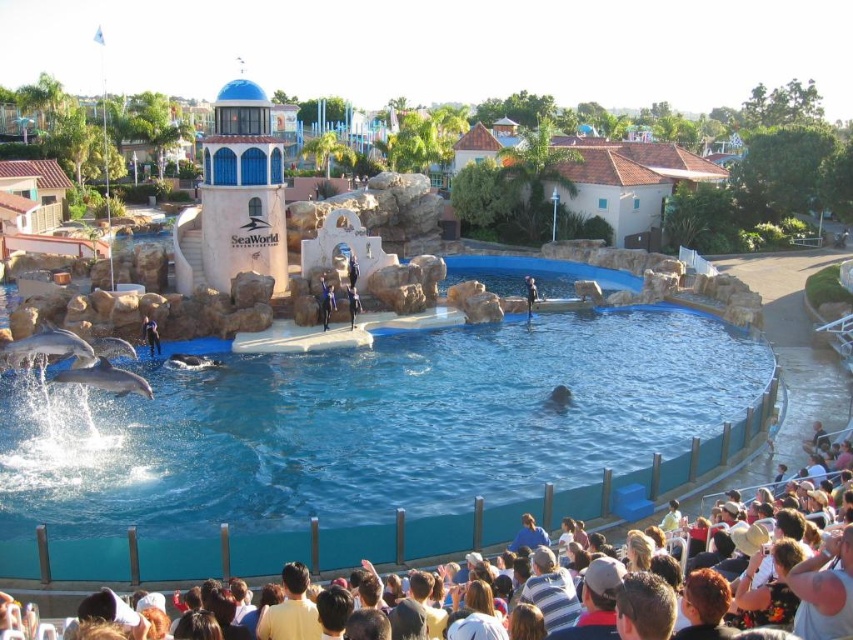
You are a photographer positioned at the front row of the bleachers. You want to take a photo of both the gray matte dolphin at lower left and the gray matte dolphin at center. However, you notice that one is blocking the other. Which dolphin is blocking the other?

The gray matte dolphin at lower left is blocking the gray matte dolphin at center because it is in front of it from your viewpoint.